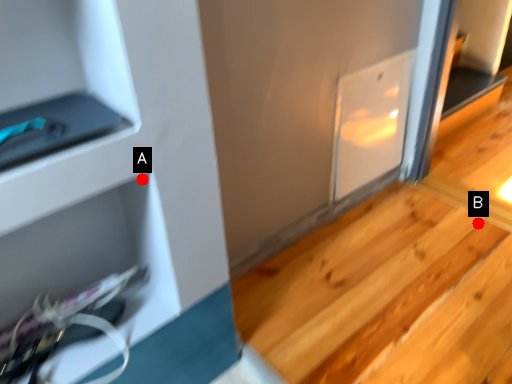
Question: Two points are circled on the image, labeled by A and B beside each circle. Which point appears farthest from the camera in this image?

Choices:
 (A) A is further
 (B) B is further

Answer: (B)